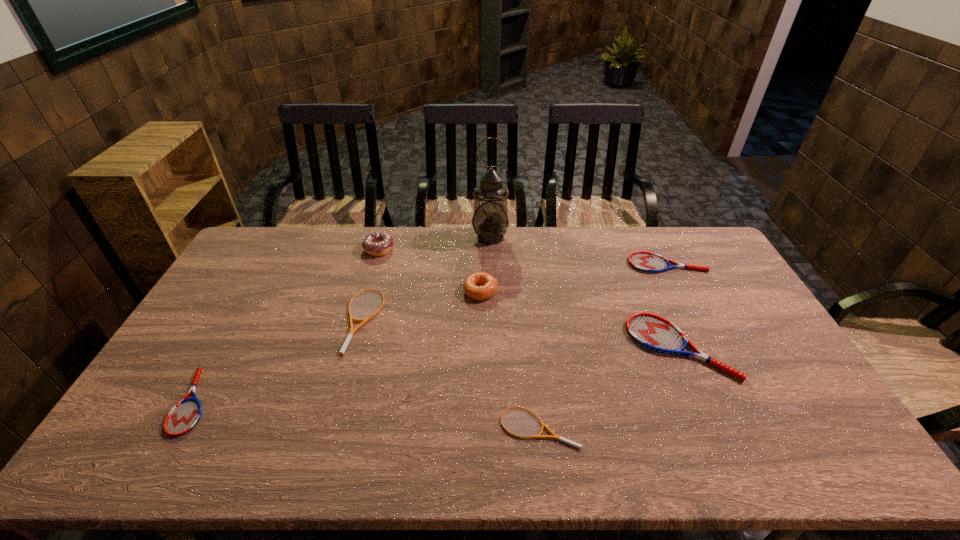
The image size is (960, 540). I want to click on free region that satisfies the following two spatial constraints: 1. on the back side of the second biggest blue tennis racket; 2. on the left side of the right beige tennis racket, so click(520, 264).

You are a GUI agent. You are given a task and a screenshot of the screen. Output one action in this format:
    pyautogui.click(x=<x>, y=<y>)
    Task: Click on the free location that satisfies the following two spatial constraints: 1. on the back side of the biggest blue tennis racket; 2. on the left side of the leftmost object
    
    Given the screenshot: What is the action you would take?
    pyautogui.click(x=225, y=347)

Identify the location of vacant area that satisfies the following two spatial constraints: 1. on the back side of the right doughnut; 2. on the left side of the tallest object. The width and height of the screenshot is (960, 540). (480, 237).